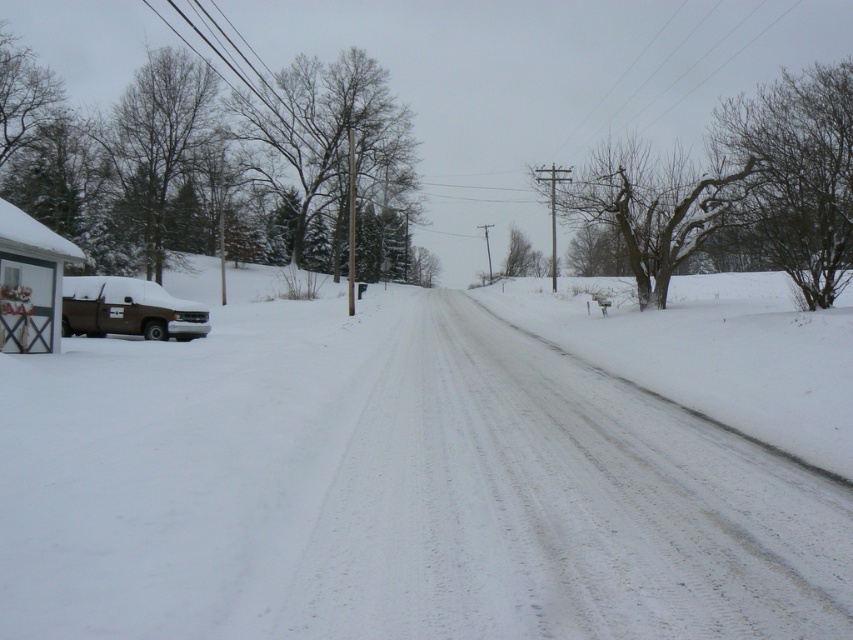
You are standing on the road and want to walk towards the brown matte truck at left. Is the white powdery snow at left between you and the truck?

Yes, the white powdery snow at left is between you and the brown matte truck at left because the white powdery snow at left is closer to the viewer than the truck.